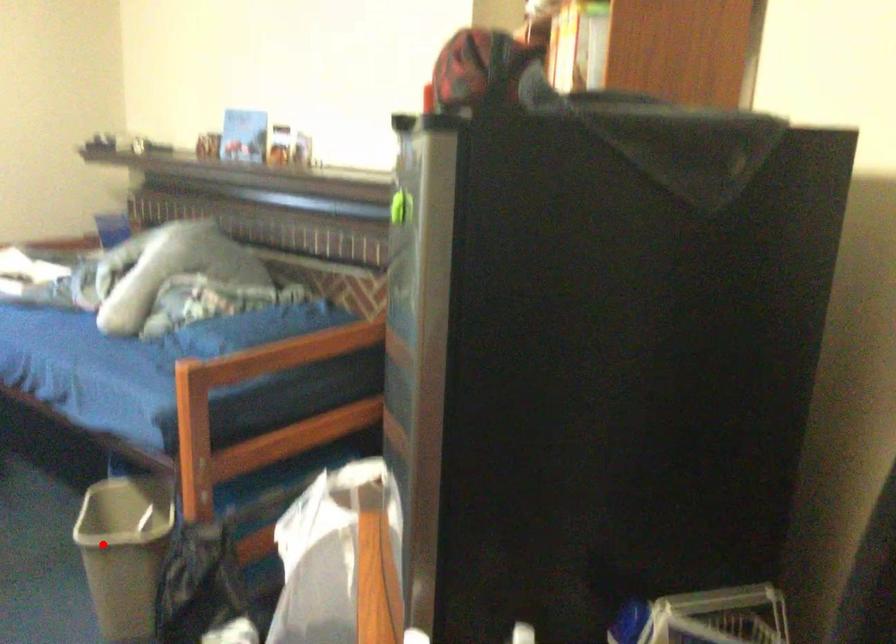
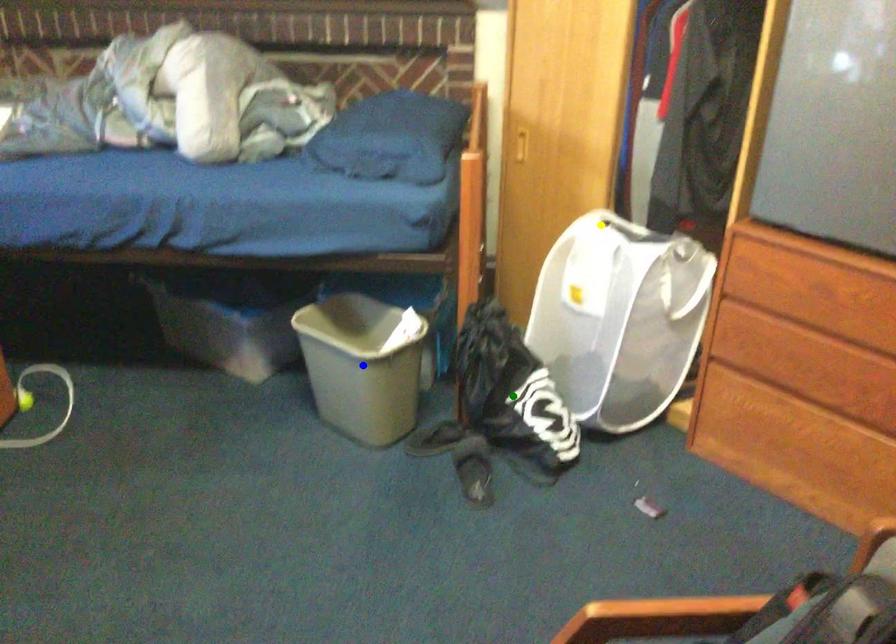
Question: I am providing you with two images of the same scene from different viewpoints. A red point is marked on the first image. You are given multiple points on the second image. Which mark in image 2 goes with the point in image 1?

Choices:
 (A) yellow point
 (B) green point
 (C) blue point

Answer: (C)